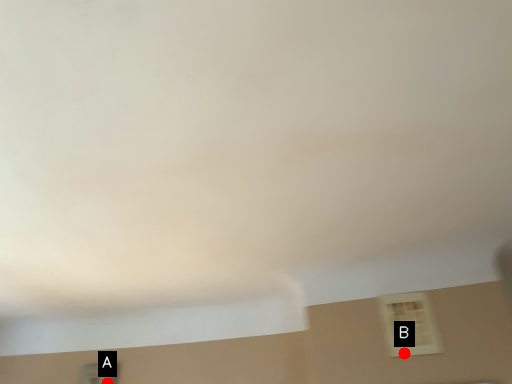
Question: Two points are circled on the image, labeled by A and B beside each circle. Which point is closer to the camera?

Choices:
 (A) A is closer
 (B) B is closer

Answer: (B)